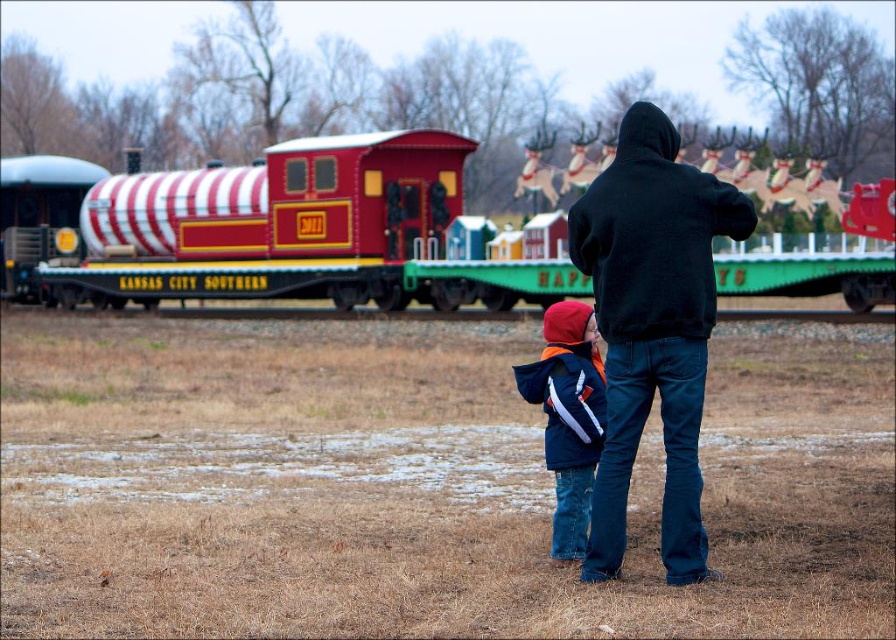
Question: Which point is farther to the camera?

Choices:
 (A) navy blue jacket at center
 (B) red and white striped train car at upper center

Answer: (A)

Question: Considering the relative positions of red and white striped train car at upper center and navy blue jacket at center in the image provided, where is red and white striped train car at upper center located with respect to navy blue jacket at center?

Choices:
 (A) below
 (B) above

Answer: (B)

Question: Which object is farther from the camera taking this photo?

Choices:
 (A) red and white striped train car at upper center
 (B) black hoodie at center

Answer: (A)

Question: Does red and white striped train car at upper center appear over black hoodie at center?

Choices:
 (A) yes
 (B) no

Answer: (A)

Question: Can you confirm if black hoodie at center is positioned below navy blue jacket at center?

Choices:
 (A) no
 (B) yes

Answer: (A)

Question: Which of the following is the farthest from the observer?

Choices:
 (A) black hoodie at center
 (B) navy blue jacket at center
 (C) red and white striped train car at upper center

Answer: (B)